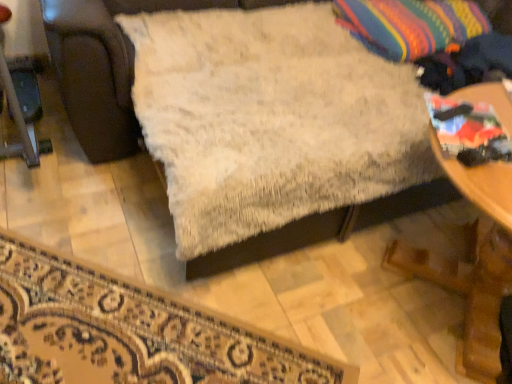
Identify the location of vacant region above white fluffy rug at lower center (from a real-world perspective). This screenshot has width=512, height=384. (87, 327).